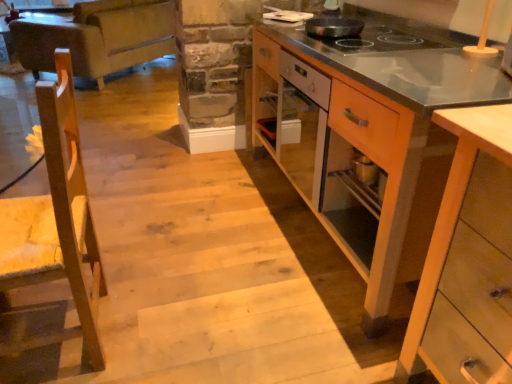
Question: Is leather couch at upper left turned away from black non-stick pan at upper center?

Choices:
 (A) yes
 (B) no

Answer: (A)

Question: Does leather couch at upper left have a greater height compared to black non-stick pan at upper center?

Choices:
 (A) yes
 (B) no

Answer: (A)

Question: Is leather couch at upper left smaller than black non-stick pan at upper center?

Choices:
 (A) yes
 (B) no

Answer: (B)

Question: Is leather couch at upper left not near black non-stick pan at upper center?

Choices:
 (A) yes
 (B) no

Answer: (A)

Question: Does leather couch at upper left have a lesser width compared to black non-stick pan at upper center?

Choices:
 (A) yes
 (B) no

Answer: (B)

Question: Is leather couch at upper left to the left of black non-stick pan at upper center from the viewer's perspective?

Choices:
 (A) no
 (B) yes

Answer: (B)

Question: Is leather couch at upper left inside black non-stick pan at upper center?

Choices:
 (A) yes
 (B) no

Answer: (B)

Question: Is black non-stick pan at upper center turned away from leather couch at upper left?

Choices:
 (A) yes
 (B) no

Answer: (B)

Question: Is black non-stick pan at upper center to the left of leather couch at upper left from the viewer's perspective?

Choices:
 (A) yes
 (B) no

Answer: (B)

Question: Is black non-stick pan at upper center thinner than leather couch at upper left?

Choices:
 (A) yes
 (B) no

Answer: (A)

Question: Is black non-stick pan at upper center located outside leather couch at upper left?

Choices:
 (A) yes
 (B) no

Answer: (A)

Question: From the image's perspective, is black non-stick pan at upper center located above leather couch at upper left?

Choices:
 (A) no
 (B) yes

Answer: (A)

Question: Is wooden cabinet at right, the first cabinetry viewed from the back, with black non-stick pan at upper center?

Choices:
 (A) no
 (B) yes

Answer: (A)